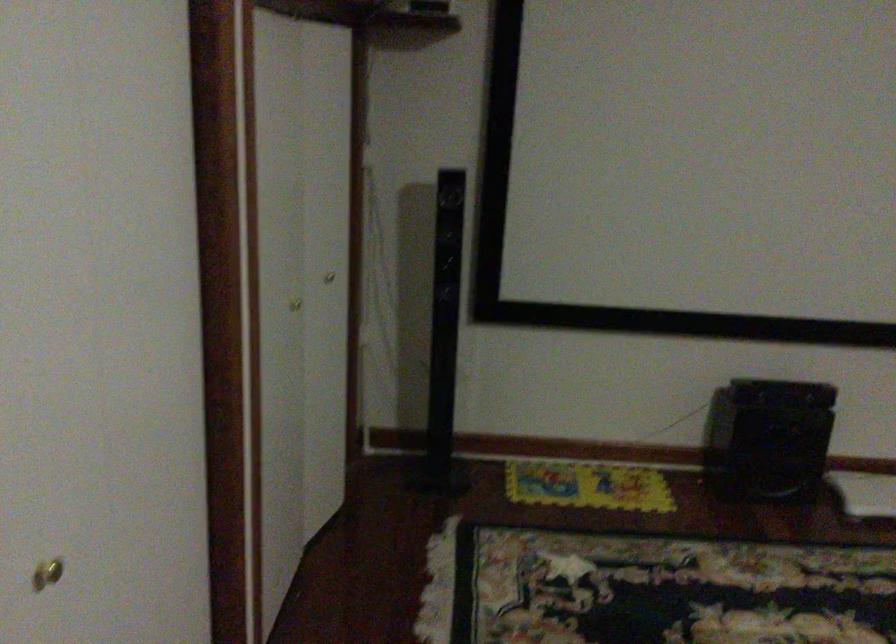
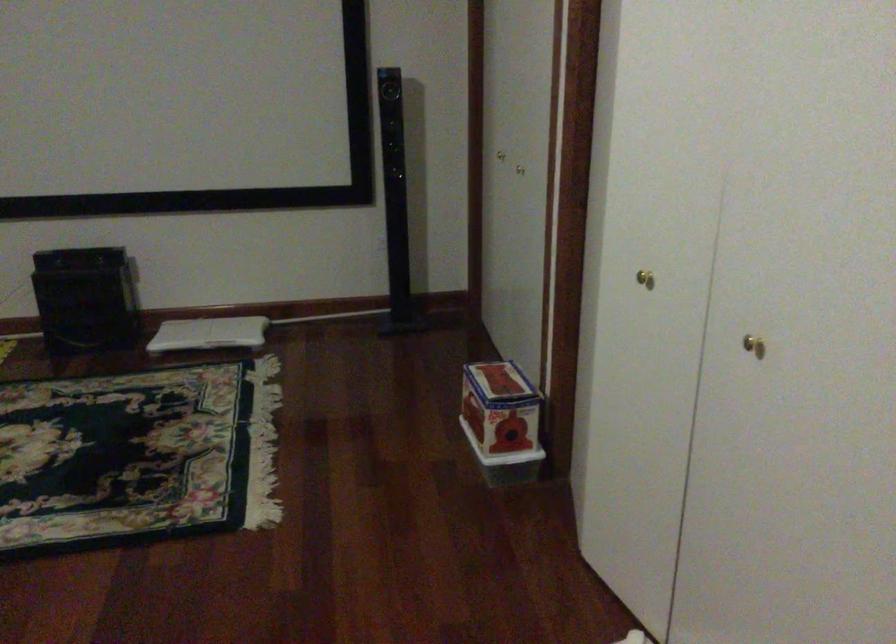
The images are taken continuously from a first-person perspective. In which direction are you moving?

The movement direction of the cameraman is right, backward.